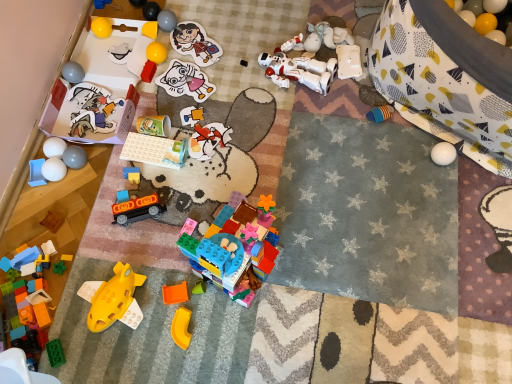
Image resolution: width=512 pixels, height=384 pixels. I want to click on unoccupied area behind yellow matte plastic arch at center, which is the 5th toy in right-to-left order, so click(170, 277).